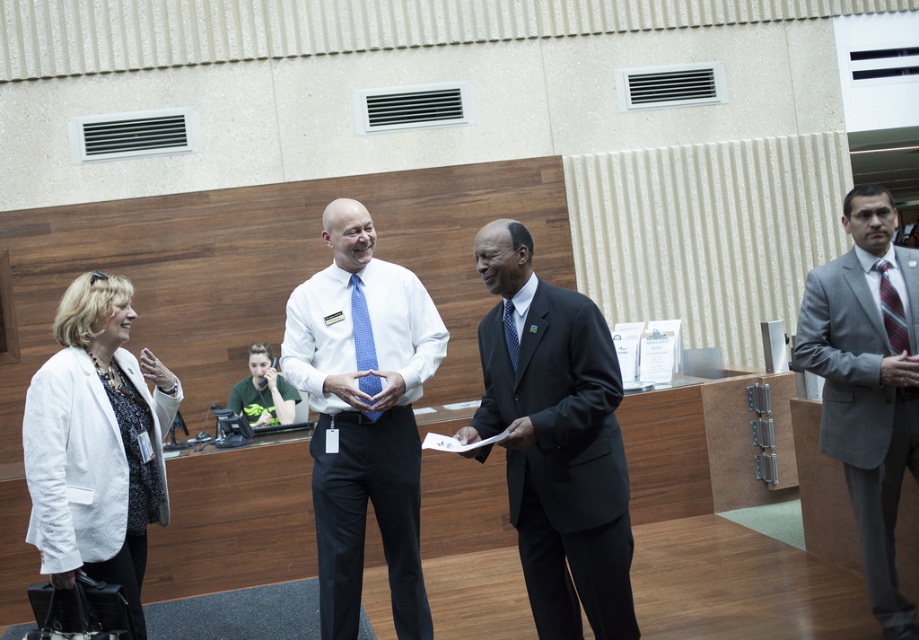
You are organizing a professional event and need to ensure that all attire adheres to a specific dress code. Given the gray suit at right and the blue dotted tie at center, which one has a greater width?

The gray suit at right has a greater width than the blue dotted tie at center according to the description.